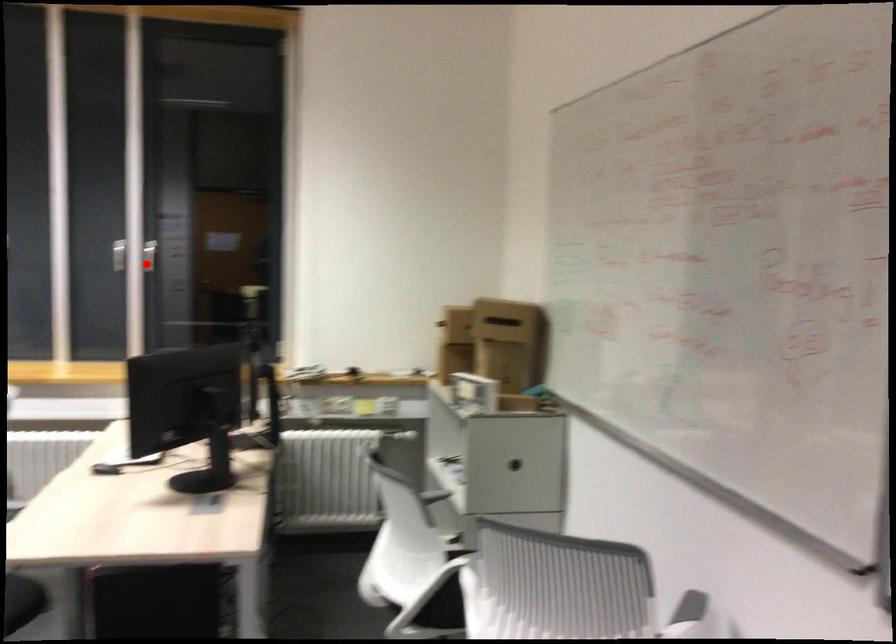
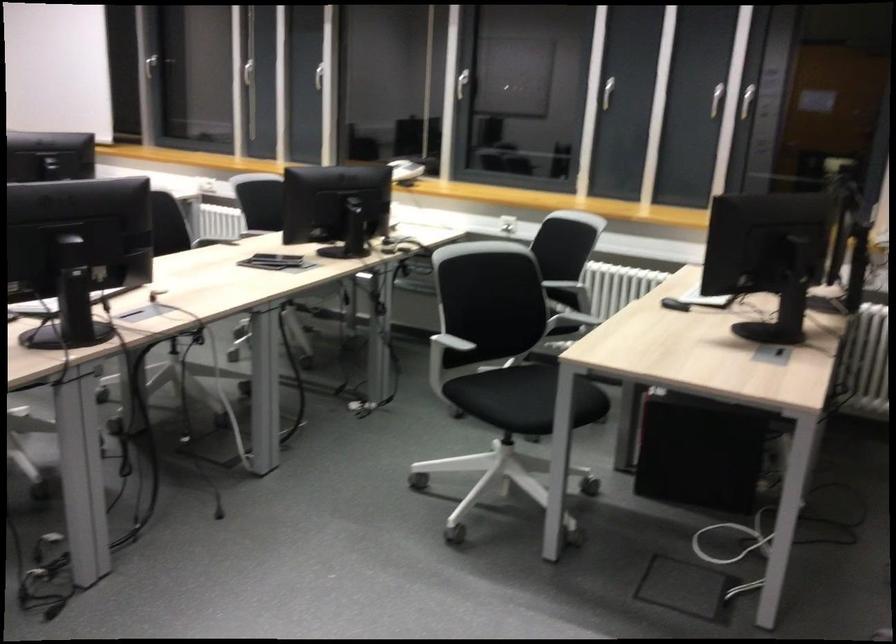
Locate, in the second image, the point that corresponds to the highlighted location in the first image.

(746, 100)